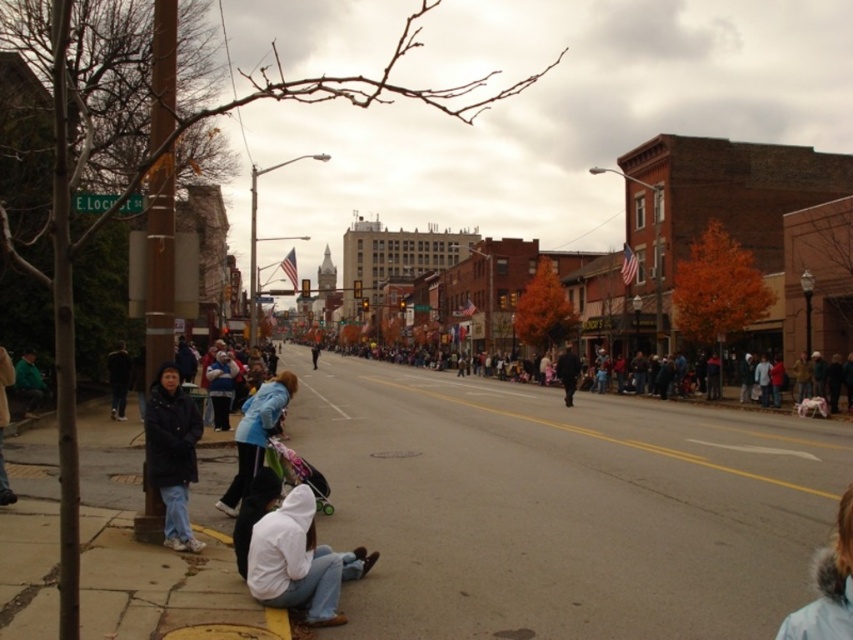
Is gray concrete pavement at lower center positioned at the back of dark blue jacket at center?

No, gray concrete pavement at lower center is closer to the viewer.

Is gray concrete pavement at lower center taller than dark blue jacket at center?

Incorrect, gray concrete pavement at lower center's height is not larger of dark blue jacket at center's.

Is point (569, 508) in front of point (566, 355)?

Yes, it is.

The height and width of the screenshot is (640, 853). I want to click on gray concrete pavement at lower center, so click(561, 506).

Does light blue jacket at lower left appear on the right side of green matte jacket at left?

Indeed, light blue jacket at lower left is positioned on the right side of green matte jacket at left.

I want to click on light blue jacket at lower left, so click(x=254, y=435).

Is point (247, 456) positioned behind point (13, 385)?

No, it is in front of (13, 385).

Where is `light blue jacket at lower left`? Image resolution: width=853 pixels, height=640 pixels. light blue jacket at lower left is located at coordinates (254, 435).

Does point (160, 460) come farther from viewer compared to point (122, 392)?

No, (160, 460) is closer to viewer.

Which is more to the right, dark blue jacket at lower left or dark brown jacket at left?

dark blue jacket at lower left is more to the right.

Which is in front, point (178, 480) or point (125, 355)?

Positioned in front is point (178, 480).

This screenshot has width=853, height=640. What are the coordinates of `dark blue jacket at lower left` in the screenshot? It's located at (172, 452).